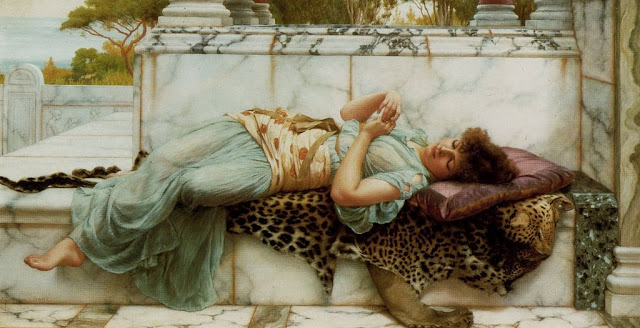
This screenshot has width=640, height=328. Find the location of `base of pillar`. base of pillar is located at coordinates (550, 16), (495, 18), (203, 14), (618, 283).